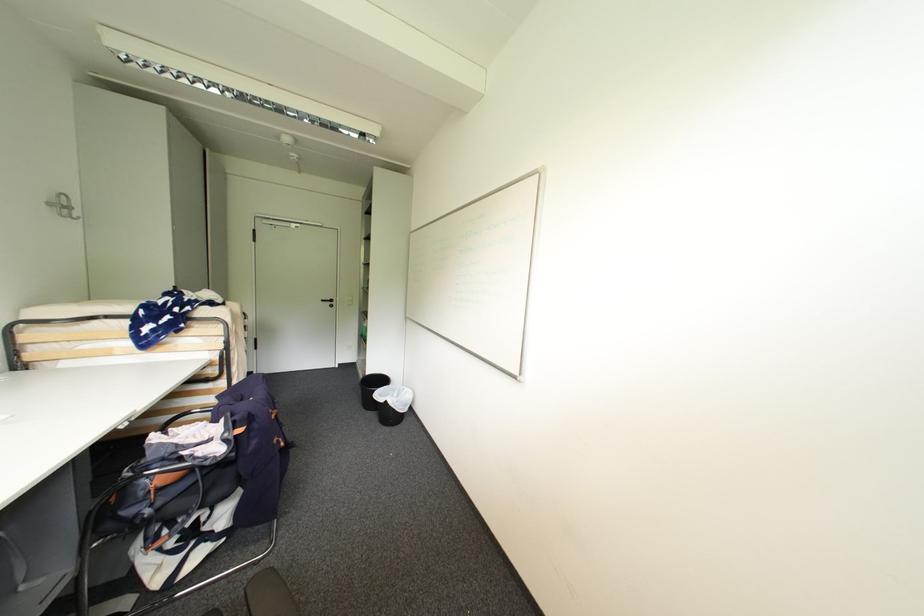
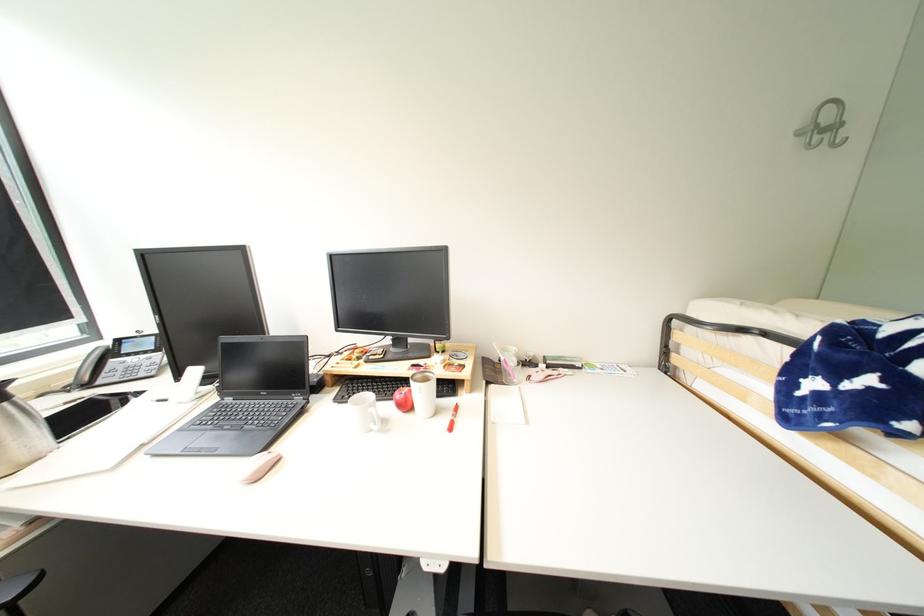
Locate, in the second image, the point that corresponds to [75,209] in the first image.

(841, 128)